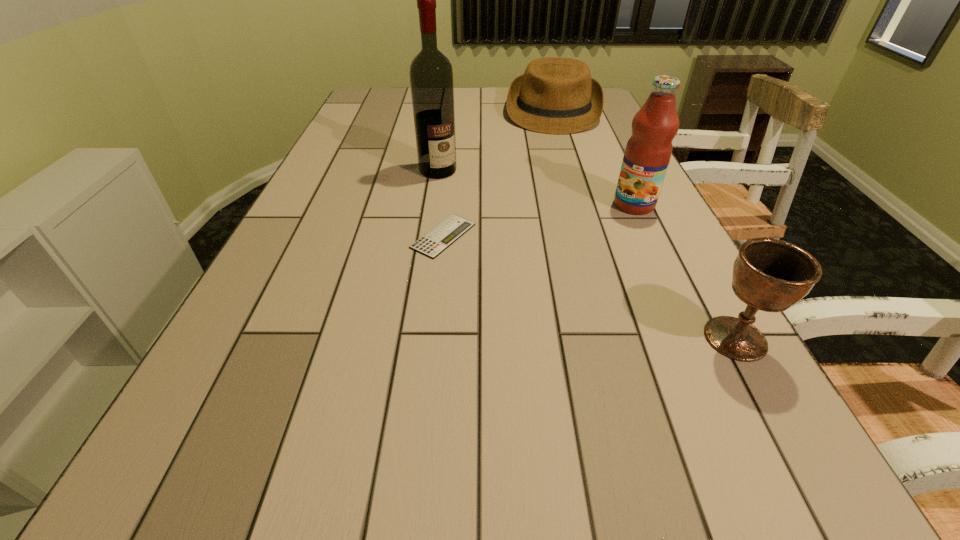
Locate an element on the screen. vacant space located on the front and back of the alcohol is located at coordinates (466, 198).

This screenshot has height=540, width=960. I want to click on vacant space located on the front and back of the alcohol, so click(519, 252).

At what (x,y) coordinates should I click in order to perform the action: click on free space located on the front and back of the alcohol. Please return your answer as a coordinate pair (x, y). The height and width of the screenshot is (540, 960). Looking at the image, I should click on (489, 221).

Where is `vacant area located on the front-facing side of the fourth tallest object`? The image size is (960, 540). vacant area located on the front-facing side of the fourth tallest object is located at coordinates (551, 148).

The width and height of the screenshot is (960, 540). Find the location of `free region located on the front-facing side of the fourth tallest object`. free region located on the front-facing side of the fourth tallest object is located at coordinates (547, 178).

Where is `free space located 0.330m on the front-facing side of the fourth tallest object`? free space located 0.330m on the front-facing side of the fourth tallest object is located at coordinates (546, 188).

Where is `free space located on the front label of the fruit juice`? Image resolution: width=960 pixels, height=540 pixels. free space located on the front label of the fruit juice is located at coordinates (563, 265).

The height and width of the screenshot is (540, 960). Find the location of `free space located on the front label of the fruit juice`. free space located on the front label of the fruit juice is located at coordinates (578, 252).

At what (x,y) coordinates should I click in order to perform the action: click on free location located 0.330m on the front label of the fruit juice. Please return your answer as a coordinate pair (x, y). The height and width of the screenshot is (540, 960). Looking at the image, I should click on (542, 281).

At what (x,y) coordinates should I click in order to perform the action: click on object located in the far edge section of the desktop. Please return your answer as a coordinate pair (x, y). Looking at the image, I should click on (555, 95).